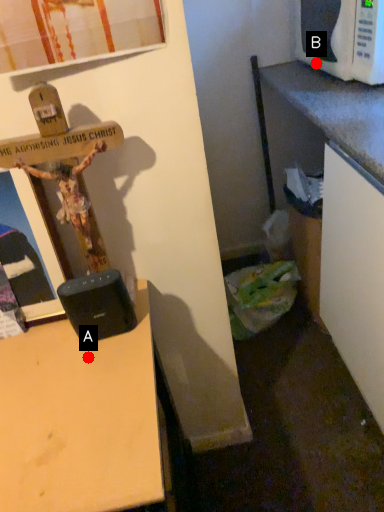
Question: Two points are circled on the image, labeled by A and B beside each circle. Which point is closer to the camera taking this photo?

Choices:
 (A) A is closer
 (B) B is closer

Answer: (A)